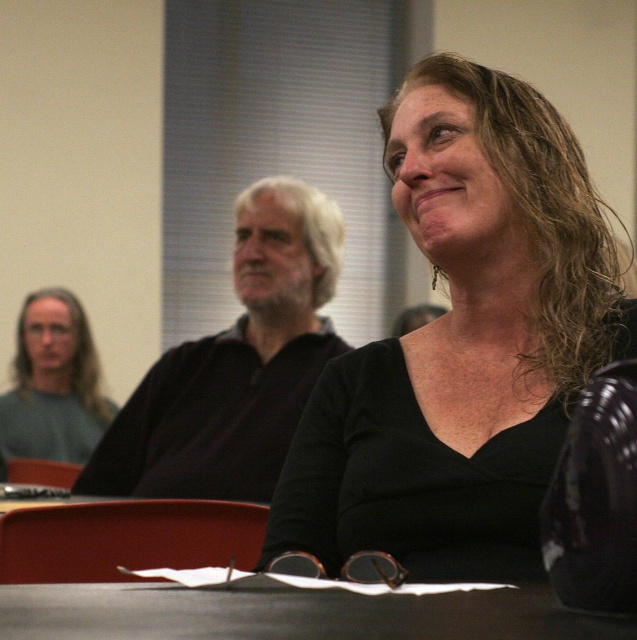
You are a photographer standing at the camera position. You want to place a small tripod on the smooth black table at center. The tripod requires a minimum of 12 inches of space between the camera and the table. Can you place the tripod there?

The smooth black table at center and camera are 30.26 inches apart, which is more than the required 12 inches. Therefore, you can place the tripod on the smooth black table at center.

You are sitting in the conference room and want to place a notebook on the smooth black table at center. However, there is a white matte hair at center in your way. Which object should you move first to reach the table?

The white matte hair at center is closer to you than the smooth black table at center, so you should move the white matte hair at center first to access the smooth black table at center.